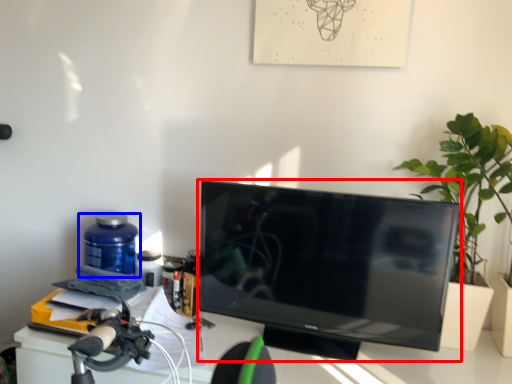
Question: Which object appears closest to the camera in this image, television (highlighted by a red box) or bottle (highlighted by a blue box)?

Choices:
 (A) television
 (B) bottle

Answer: (A)